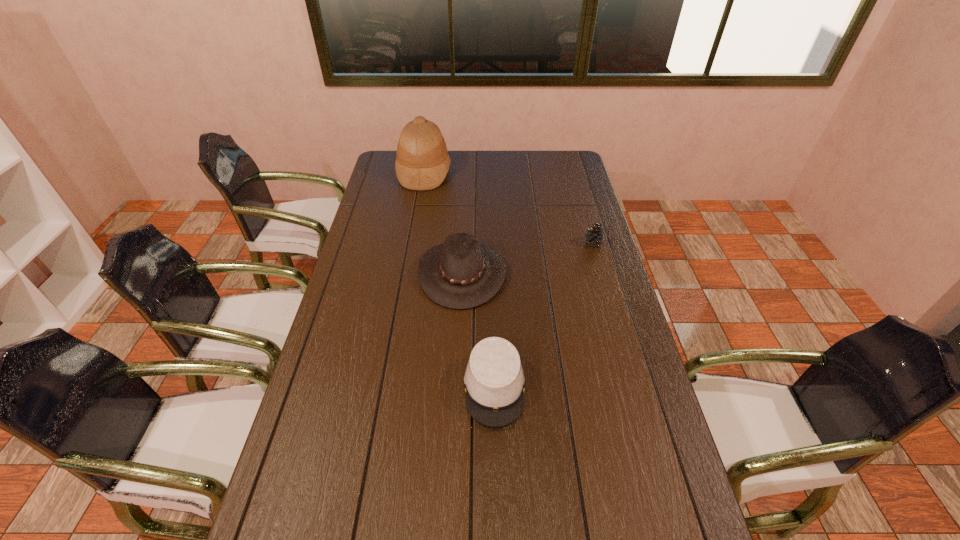
The image size is (960, 540). Identify the location of free spot located 0.110m on the front-facing side of the nearest object. (497, 475).

Where is `object that is positioned at the far edge`? The height and width of the screenshot is (540, 960). object that is positioned at the far edge is located at coordinates (422, 162).

Identify the location of object located in the left edge section of the desktop. The image size is (960, 540). coord(422,162).

Locate an element on the screen. The image size is (960, 540). object located in the right edge section of the desktop is located at coordinates (594, 236).

Image resolution: width=960 pixels, height=540 pixels. What are the coordinates of `object that is at the far left corner` in the screenshot? It's located at (422, 162).

I want to click on free space at the far edge, so click(487, 172).

Find the location of a particular element. vacant region at the left edge is located at coordinates (365, 390).

The image size is (960, 540). Find the location of `vacant space at the right edge of the desktop`. vacant space at the right edge of the desktop is located at coordinates (589, 304).

Locate an element on the screen. The height and width of the screenshot is (540, 960). free space that is in between the farthest object and the second tallest object is located at coordinates [444, 222].

Locate an element on the screen. This screenshot has height=540, width=960. blank region between the pinecone and the nearest object is located at coordinates (544, 315).